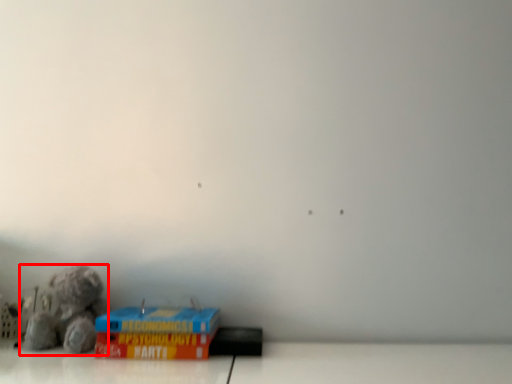
Question: From the image's perspective, what is the correct spatial positioning of toy (annotated by the red box) in reference to cardboard box?

Choices:
 (A) above
 (B) below

Answer: (A)